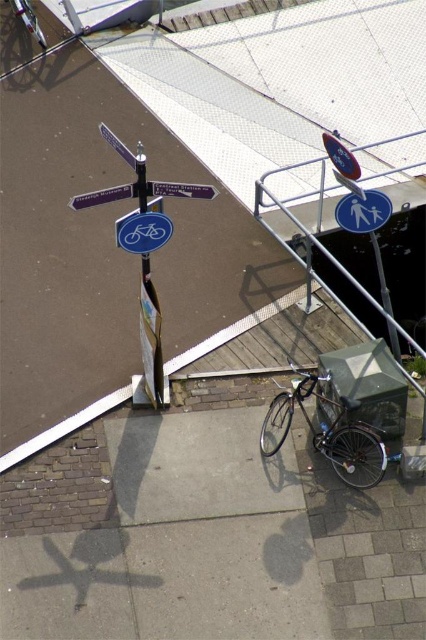
Question: Based on their relative distances, which object is farther from the matte purple signpost at upper left?

Choices:
 (A) white plastic signpost at center
 (B) blue plastic street sign at upper left
 (C) shiny metallic bicycle at center
 (D) metallic silver pole at center

Answer: (C)

Question: Among these points, which one is nearest to the camera?

Choices:
 (A) (371, 449)
 (B) (210, 192)
 (C) (132, 240)

Answer: (B)

Question: Is shiny metallic bicycle at center above blue plastic street sign at upper left?

Choices:
 (A) yes
 (B) no

Answer: (B)

Question: Among these objects, which one is nearest to the camera?

Choices:
 (A) white plastic signpost at center
 (B) metallic silver pole at center
 (C) matte purple signpost at upper left

Answer: (C)

Question: Does matte purple signpost at upper left appear on the left side of blue plastic street sign at upper left?

Choices:
 (A) no
 (B) yes

Answer: (B)

Question: Is matte purple signpost at upper left bigger than blue plastic street sign at upper left?

Choices:
 (A) yes
 (B) no

Answer: (B)